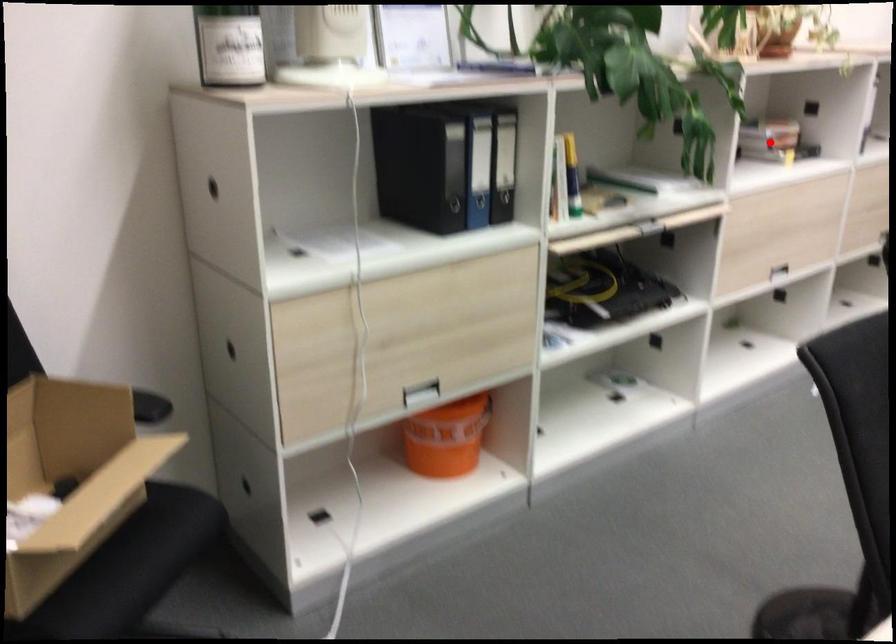
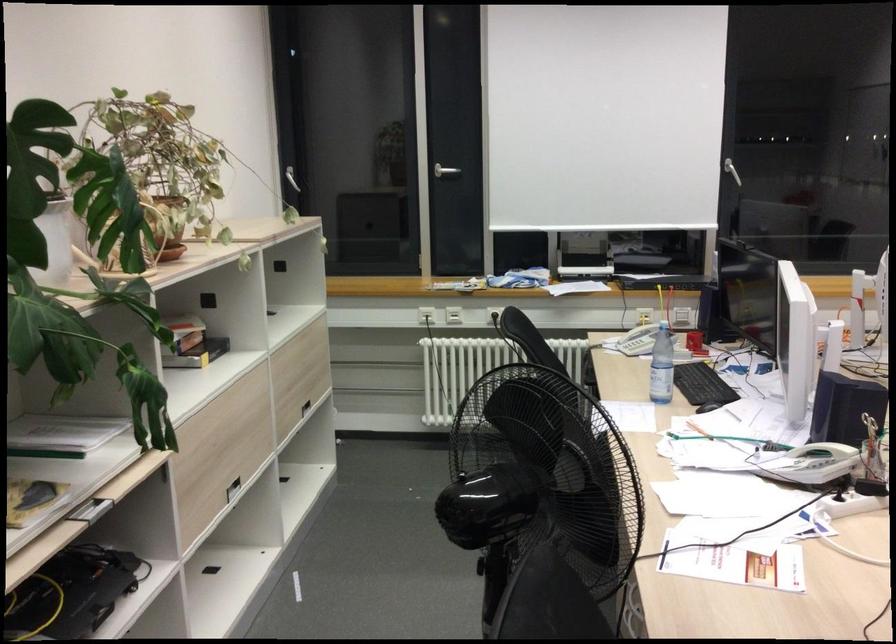
Question: I am providing you with two images of the same scene from different viewpoints. A red point is marked on the first image. Can you still see the location of the red point in image 2?

Choices:
 (A) Yes
 (B) No

Answer: (A)